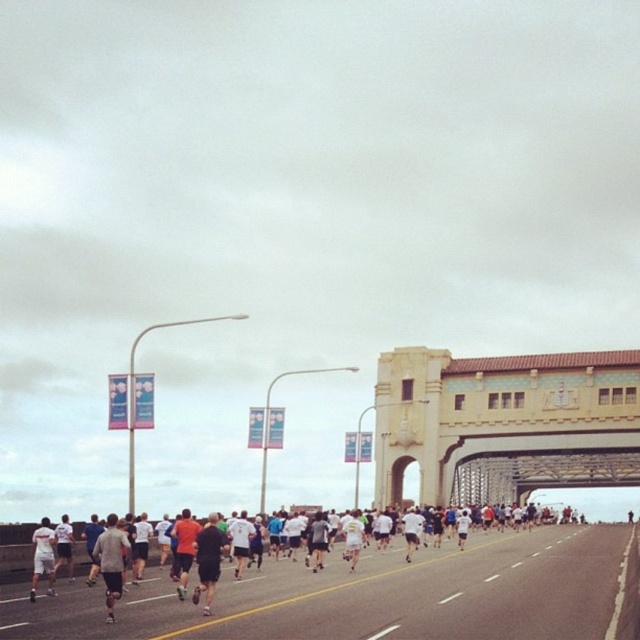
You are a runner in the marathon and you want to know if the yellow concrete bridge at center is taller than your white matte shorts at center. Can you determine this based on the scene?

The yellow concrete bridge at center is not as tall as white matte shorts at center, so the bridge is shorter than your shorts.

You are a runner in the marathon and you want to reach the yellow concrete bridge at center. You are currently at point (x=504, y=422). Is the point you are currently at on the bridge?

Yes, the point (x=504, y=422) is on the yellow concrete bridge at center, so you are already on the bridge.

You are a photographer positioned at the starting line of the marathon. You want to capture a photo that includes both the yellow concrete bridge at center and the dark gray athletic wear at center. Which object should you adjust your camera focus on first to ensure both are in the frame?

The yellow concrete bridge at center is further to the viewer than the dark gray athletic wear at center, so you should focus on the yellow concrete bridge at center first to ensure both are in the frame.